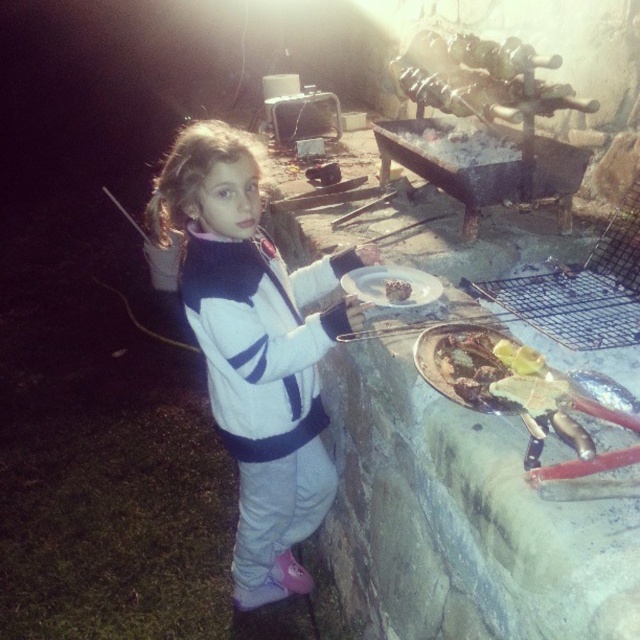
Does point (246, 586) lie in front of point (403, 292)?

No, it is behind (403, 292).

Does point (266, 492) come farther from viewer compared to point (388, 291)?

Yes, point (266, 492) is farther from viewer.

Is point (179, 264) less distant than point (403, 285)?

No, it is not.

Locate an element on the screen. Image resolution: width=640 pixels, height=640 pixels. white fleece jacket at center is located at coordinates (253, 348).

Between white matte plate at center and white matte plate at upper center, which one appears on the left side from the viewer's perspective?

Positioned to the left is white matte plate at center.

Consider the image. Between white matte plate at center and white matte plate at upper center, which one is positioned higher?

white matte plate at center is higher up.

Is point (378, 305) more distant than point (397, 282)?

No.

Where is `white matte plate at center`? white matte plate at center is located at coordinates (392, 280).

Describe the element at coordinates (253, 348) in the screenshot. I see `white fleece jacket at center` at that location.

In order to click on white fleece jacket at center in this screenshot , I will do `click(253, 348)`.